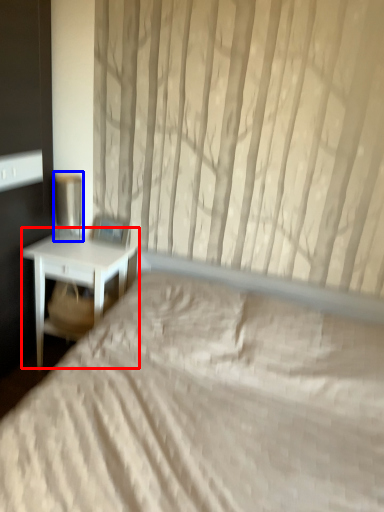
Question: Which point is further to the camera, nightstand (highlighted by a red box) or table lamp (highlighted by a blue box)?

Choices:
 (A) nightstand
 (B) table lamp

Answer: (B)